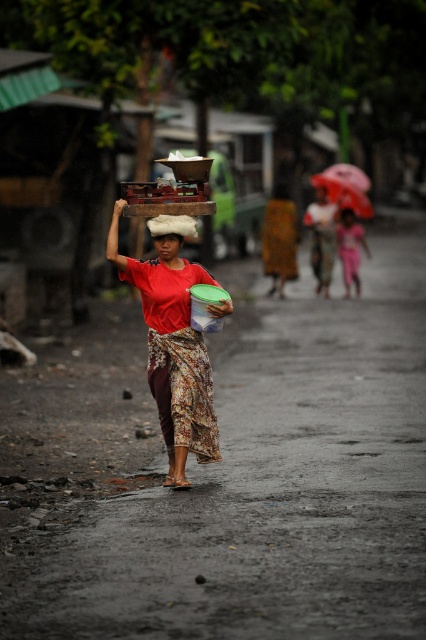
You are a photographer standing at a certain distance from the scene. You want to capture a clear photo of the matte red shirt at center without including any background elements. Given that the camera has a focal length of 50mm and an aperture of f2.8, can you determine if the depth of field will allow for the background to be sufficiently blurred?

The matte red shirt at center is 8.63 meters away from the camera. With a focal length of 50mm and aperture f2.8, the depth of field calculation shows that the background elements will be sufficiently blurred, allowing the matte red shirt at center to be the main focus of the photo.

In the scene shown: What are the coordinates of the matte red shirt at center?

The matte red shirt at center is located at coordinates point (172,346).

You are a pedestrian trying to cross the street in the rain. You see the red fabric umbrella at upper right and the smooth plastic head at center. Which object is closer to you?

The red fabric umbrella at upper right is closer to you because the smooth plastic head at center is behind it.